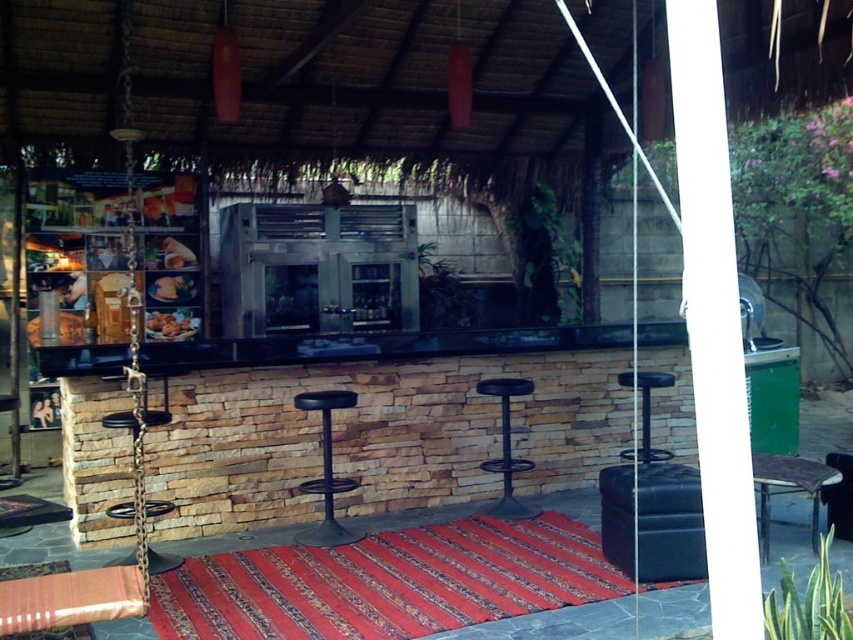
You are standing in front of the outdoor bar and want to determine which of the two points, point (792,486) or point (194,320), is closer to you. Based on the scene description, which point is nearer?

Point (792,486) is closer to the camera than point (194,320).

You are standing at the entrance of the outdoor bar area and want to sit down. Where is the metallic stool at lower right located relative to your position?

The metallic stool at lower right is located at point (788, 490), which is to the right and slightly ahead of your position at the entrance.